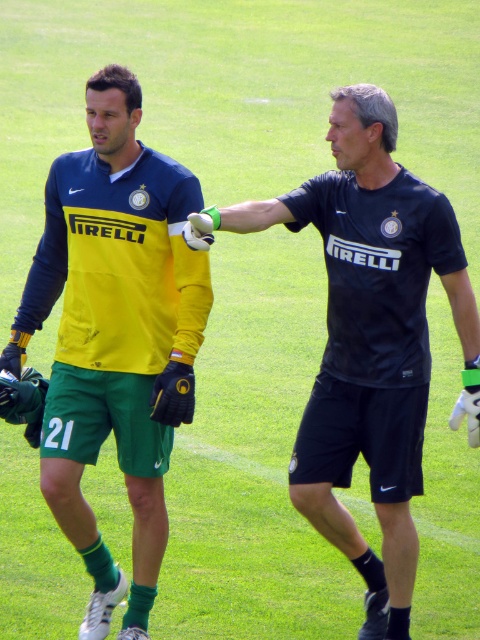
You are a soccer coach observing a training session. You notice two players wearing the yellow matte jersey at left and the black matte shirt at center. Which player has a narrower torso? Please explain your reasoning based on their clothing.

The yellow matte jersey at left is thinner than the black matte shirt at center, indicating that the player wearing the yellow matte jersey at left has a narrower torso compared to the player in the black matte shirt at center.

You are a soccer coach observing a training session. You see the yellow matte jersey at left and the other player. How far apart are they?

The yellow matte jersey at left and the other player are 5.55 meters apart.